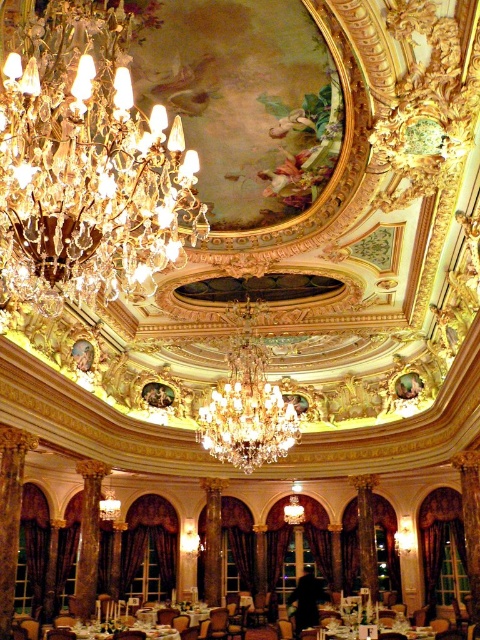
Who is taller, clear crystal chandelier at center or wooden polished table at center?

With more height is clear crystal chandelier at center.

Can you confirm if clear crystal chandelier at center is positioned above wooden polished table at center?

Correct, clear crystal chandelier at center is located above wooden polished table at center.

Where is `clear crystal chandelier at center`? This screenshot has width=480, height=640. clear crystal chandelier at center is located at coordinates (247, 404).

Between crystal glass chandelier at upper left and wooden polished table at center, which one has less height?

wooden polished table at center

Is point (16, 252) closer to camera compared to point (144, 624)?

Yes, it is in front of point (144, 624).

Where is `crystal glass chandelier at upper left`? This screenshot has width=480, height=640. crystal glass chandelier at upper left is located at coordinates (86, 163).

Can you confirm if crystal glass chandelier at upper left is positioned below white glossy table at lower center?

No.

Between point (147, 291) and point (99, 624), which one is positioned behind?

Positioned behind is point (99, 624).

Locate an element on the screen. This screenshot has width=480, height=640. crystal glass chandelier at upper left is located at coordinates [x=86, y=163].